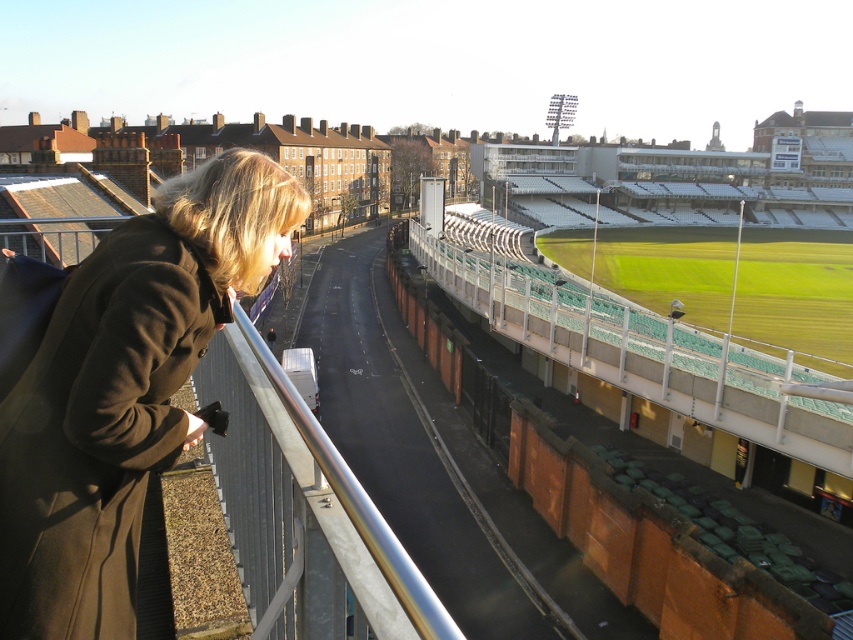
Does matte brown coat at left have a lesser height compared to silver metallic railing at center?

In fact, matte brown coat at left may be taller than silver metallic railing at center.

Who is taller, matte brown coat at left or silver metallic railing at center?

Standing taller between the two is matte brown coat at left.

Image resolution: width=853 pixels, height=640 pixels. I want to click on matte brown coat at left, so click(125, 390).

You are a GUI agent. You are given a task and a screenshot of the screen. Output one action in this format:
    pyautogui.click(x=<x>, y=<y>)
    Task: Click on the matte brown coat at left
    
    Given the screenshot: What is the action you would take?
    pyautogui.click(x=125, y=390)